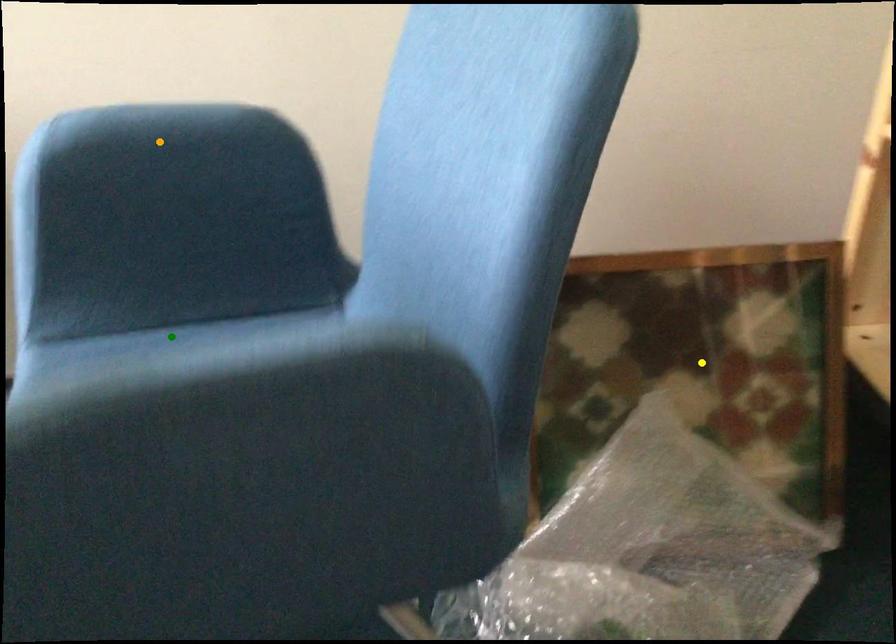
Order these from nearest to farthest:
green point
yellow point
orange point

orange point → green point → yellow point